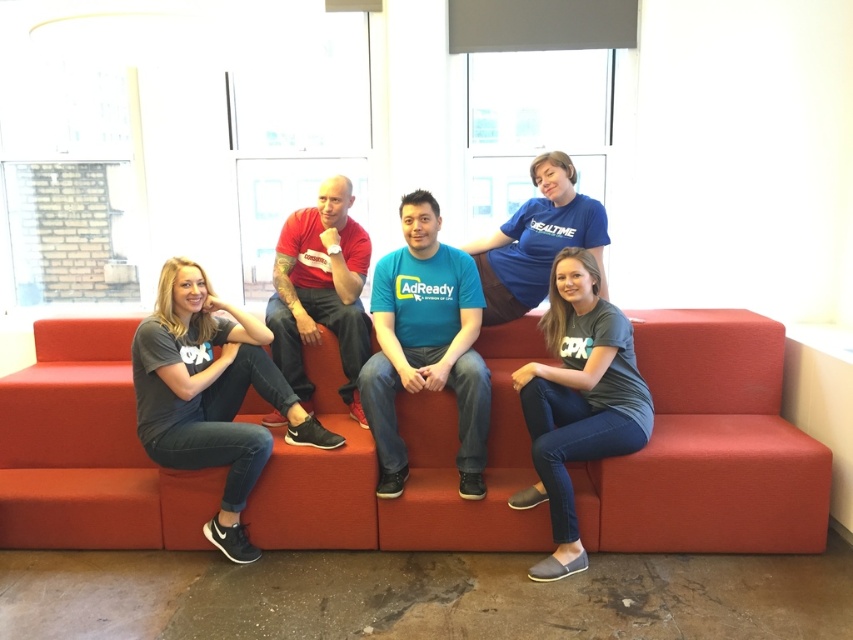
Who is lower down, gray fabric shirt at left or matte red shirt at center?

gray fabric shirt at left

Can you confirm if gray fabric shirt at left is positioned above matte red shirt at center?

No, gray fabric shirt at left is not above matte red shirt at center.

Is point (244, 525) positioned after point (300, 291)?

No, it is in front of (300, 291).

This screenshot has width=853, height=640. In order to click on gray fabric shirt at left in this screenshot , I will do `click(212, 396)`.

Which of these two, matte red shirt at center or blue cotton shirt at center, stands taller?

matte red shirt at center is taller.

Who is more distant from viewer, (323, 214) or (583, 225)?

The point (323, 214) is more distant.

Is point (302, 275) closer to viewer compared to point (511, 224)?

Yes, it is in front of point (511, 224).

This screenshot has height=640, width=853. In order to click on matte red shirt at center in this screenshot , I will do `click(320, 291)`.

Who is higher up, gray fabric shirt at left or gray cotton shirt at center?

gray fabric shirt at left

What do you see at coordinates (212, 396) in the screenshot?
I see `gray fabric shirt at left` at bounding box center [212, 396].

You are a GUI agent. You are given a task and a screenshot of the screen. Output one action in this format:
    pyautogui.click(x=<x>, y=<y>)
    Task: Click on the gray fabric shirt at left
    
    Given the screenshot: What is the action you would take?
    pyautogui.click(x=212, y=396)